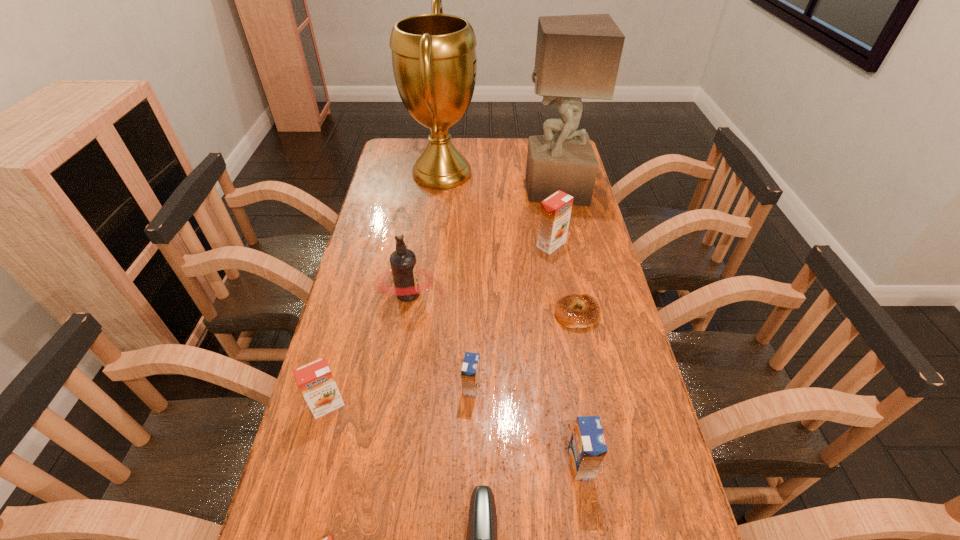
The image size is (960, 540). What are the coordinates of `the left blue orange_juice` in the screenshot? It's located at (470, 373).

I want to click on tan bagel, so click(589, 315).

I want to click on bagel, so click(589, 315).

Find the location of `free space located 0.280m on the surface of the gold trophy cup with symbols`. free space located 0.280m on the surface of the gold trophy cup with symbols is located at coordinates (547, 173).

Image resolution: width=960 pixels, height=540 pixels. Find the location of `free location located on the front-facing side of the gray sculpture`. free location located on the front-facing side of the gray sculpture is located at coordinates (483, 189).

At what (x,y) coordinates should I click in order to perform the action: click on blank space located 0.390m on the front-facing side of the gray sculpture. Please return your answer as a coordinate pair (x, y). Looking at the image, I should click on (422, 189).

Locate an element on the screen. This screenshot has width=960, height=540. free space located on the front-facing side of the gray sculpture is located at coordinates (506, 189).

The width and height of the screenshot is (960, 540). In order to click on free space located on the label of the root beer in this screenshot , I will do `click(497, 294)`.

Where is `free location located 0.070m on the right of the farthest orange juice`? The image size is (960, 540). free location located 0.070m on the right of the farthest orange juice is located at coordinates (588, 244).

Locate an element on the screen. free spot located 0.400m on the right of the second nearest orange orange juice is located at coordinates (513, 404).